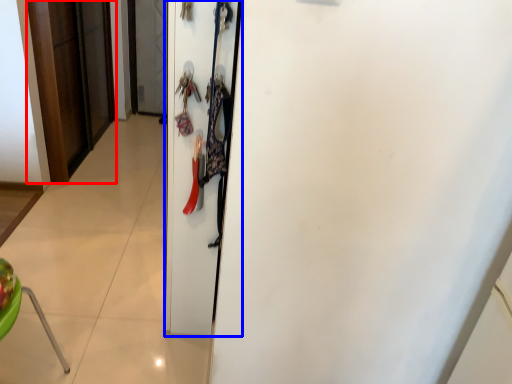
Question: Which object is closer to the camera taking this photo, door (highlighted by a red box) or door (highlighted by a blue box)?

Choices:
 (A) door
 (B) door

Answer: (B)